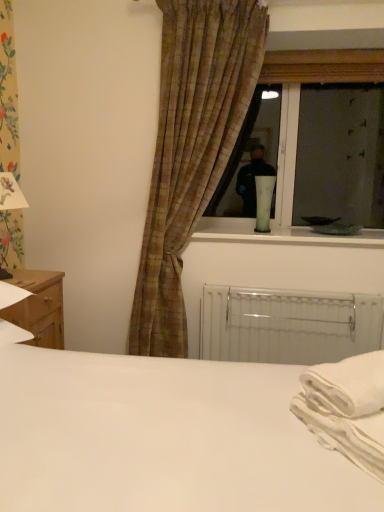
Find the location of a particular element. vacant space behind green glass vase at window, marked as the 1th table lamp in a back-to-front arrangement is located at coordinates (253, 230).